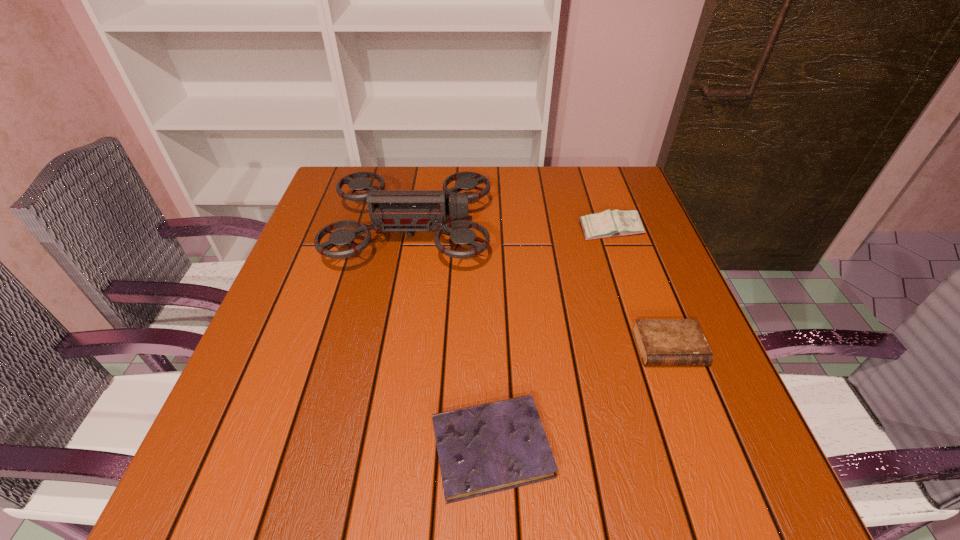
Locate an element on the screen. vacant region at the far right corner of the desktop is located at coordinates [624, 173].

This screenshot has width=960, height=540. In order to click on vacant space in between the tallest object and the tallest diary in this screenshot , I will do `click(511, 231)`.

Locate an element on the screen. This screenshot has height=540, width=960. free area in between the second farthest diary and the shortest object is located at coordinates (580, 398).

The height and width of the screenshot is (540, 960). Identify the location of empty space between the nearest diary and the farthest diary. (551, 339).

Identify the location of free area in between the second tallest diary and the tallest object. The image size is (960, 540). pyautogui.click(x=540, y=290).

This screenshot has height=540, width=960. I want to click on vacant space in between the shortest diary and the drone, so click(x=451, y=340).

Image resolution: width=960 pixels, height=540 pixels. What are the coordinates of `free space that is in between the drone and the second tallest diary` in the screenshot? It's located at [x=540, y=290].

Find the location of a particular element. The image size is (960, 540). vacant point located between the tallest object and the shortest object is located at coordinates (451, 340).

Where is `empty location between the farthest diary and the drone`? This screenshot has height=540, width=960. empty location between the farthest diary and the drone is located at coordinates (511, 231).

Where is `free area in between the second shortest object and the drone`? free area in between the second shortest object and the drone is located at coordinates (540, 290).